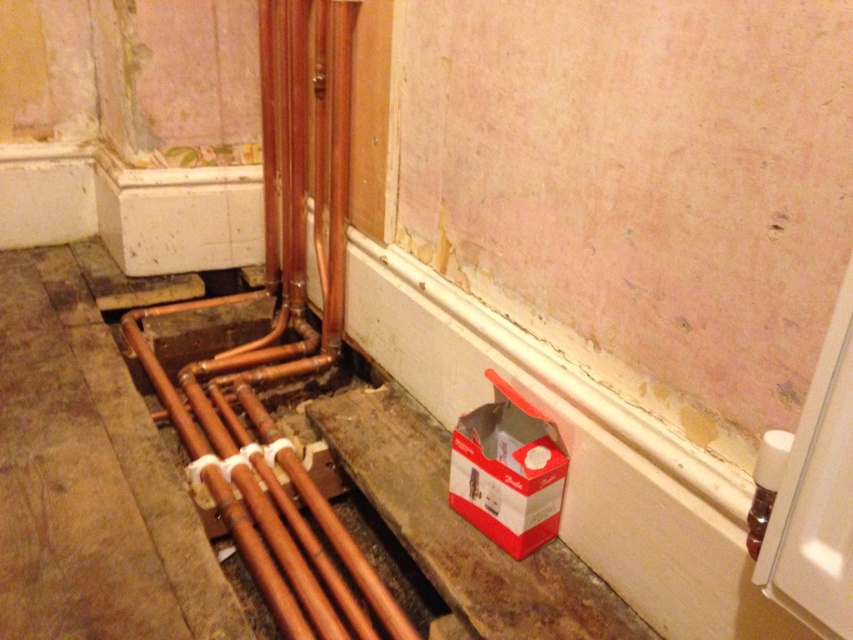
Where is `copper pipes at lower left`? The width and height of the screenshot is (853, 640). copper pipes at lower left is located at coordinates (268, 500).

Between point (297, 595) and point (532, 420), which one is positioned behind?

The point (297, 595) is behind.

Locate an element on the screen. The width and height of the screenshot is (853, 640). copper pipes at lower left is located at coordinates (268, 500).